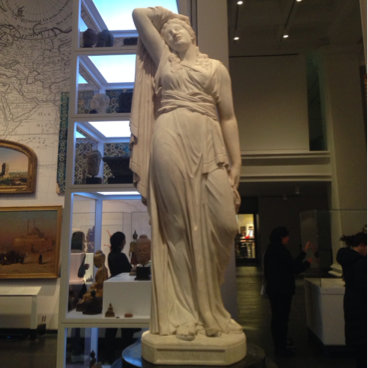
Locate an element on the screen. The height and width of the screenshot is (368, 368). portrait is located at coordinates (39, 237).